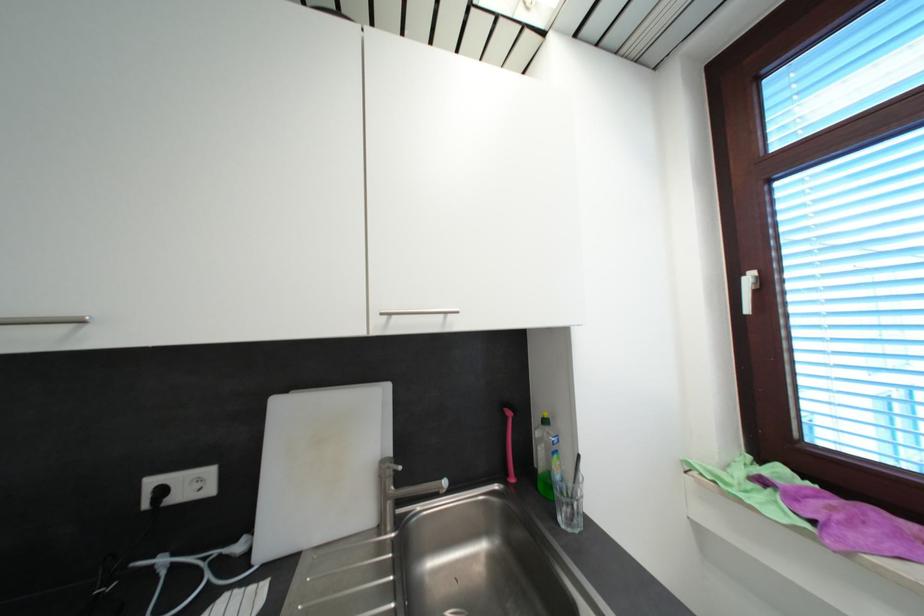
The image size is (924, 616). Describe the element at coordinates (546, 456) in the screenshot. I see `the green dish soap` at that location.